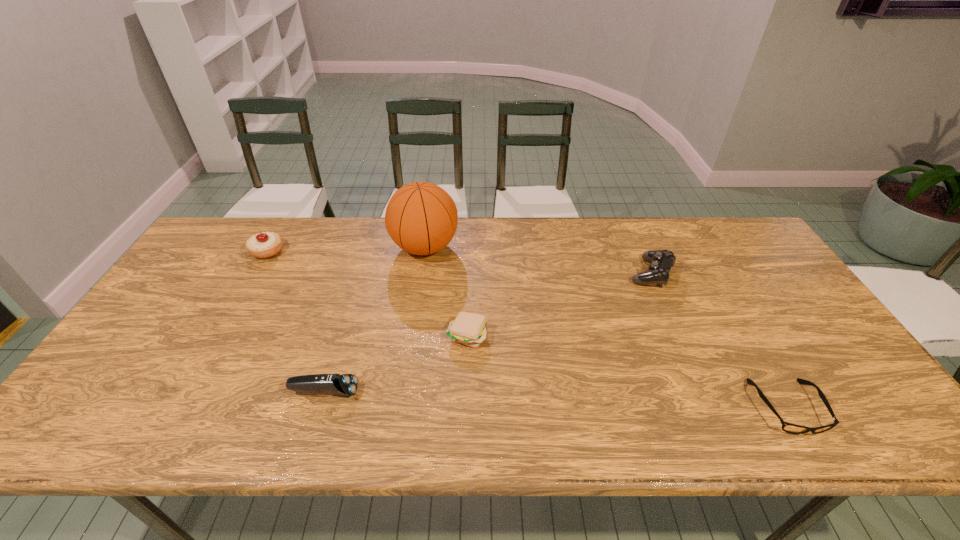
Where is `free location at the near edge`? This screenshot has height=540, width=960. free location at the near edge is located at coordinates (534, 437).

You are a GUI agent. You are given a task and a screenshot of the screen. Output one action in this format:
    pyautogui.click(x=<x>, y=<y>)
    Task: Click on the vacant space at the left edge of the desktop
    The width and height of the screenshot is (960, 540).
    Given the screenshot: What is the action you would take?
    pyautogui.click(x=143, y=336)

This screenshot has width=960, height=540. Identify the location of free space at the right edge of the desktop. (727, 268).

Where is `free space between the second tallest object and the control`? The height and width of the screenshot is (540, 960). free space between the second tallest object and the control is located at coordinates (459, 262).

This screenshot has width=960, height=540. What are the coordinates of `free space between the control and the patty` in the screenshot? It's located at (559, 304).

What are the coordinates of `vacant point located between the pastry and the patty` in the screenshot? It's located at (368, 293).

At what (x,y) coordinates should I click in order to perform the action: click on vacant area that lies between the tallest object and the fifth object from left to right. Please return your answer as a coordinate pair (x, y). This screenshot has height=540, width=960. Looking at the image, I should click on (538, 260).

Find the location of `unoccupied position between the electric shaver and the third nearest object`. unoccupied position between the electric shaver and the third nearest object is located at coordinates (396, 363).

This screenshot has width=960, height=540. Identify the location of free space between the control and the patty. (559, 304).

Locate an element on the screen. The height and width of the screenshot is (540, 960). free spot between the control and the patty is located at coordinates (559, 304).